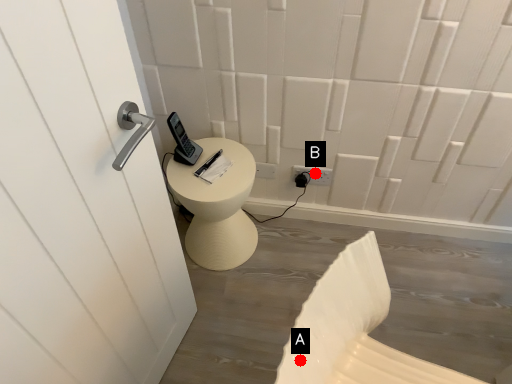
Question: Two points are circled on the image, labeled by A and B beside each circle. Which point appears farthest from the camera in this image?

Choices:
 (A) A is further
 (B) B is further

Answer: (B)